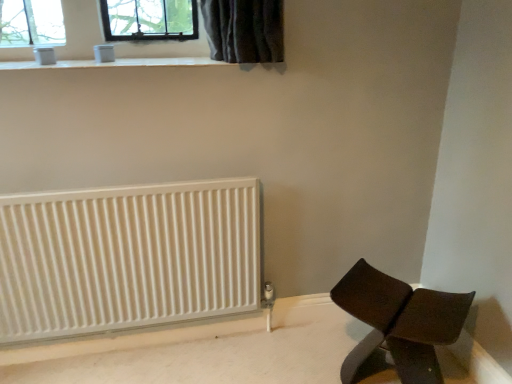
What is the approximate width of brown leather chair at lower right?

brown leather chair at lower right is 32.71 centimeters in width.

Describe the element at coordinates (114, 63) in the screenshot. This screenshot has height=384, width=512. I see `white smooth window sill at upper center` at that location.

Consider the image. In order to face white ribbed radiator at lower left, should I rotate leftwards or rightwards?

You should look left and rotate roughly 16.006 degrees.

Identify the location of brown leather chair at lower right. (400, 322).

Based on the photo, is brown leather chair at lower right smaller than white smooth window sill at upper center?

Actually, brown leather chair at lower right might be larger than white smooth window sill at upper center.

Does brown leather chair at lower right have a greater width compared to white smooth window sill at upper center?

No.

Does point (452, 293) come in front of point (201, 58)?

That is True.

Is white smooth window sill at upper center wider or thinner than white ribbed radiator at lower left?

Clearly, white smooth window sill at upper center has more width compared to white ribbed radiator at lower left.

Between white smooth window sill at upper center and white ribbed radiator at lower left, which one has less height?

white smooth window sill at upper center.

Is white smooth window sill at upper center facing towards white ribbed radiator at lower left?

No, white smooth window sill at upper center is not oriented towards white ribbed radiator at lower left.

From a real-world perspective, is white smooth window sill at upper center positioned above or below white ribbed radiator at lower left?

white smooth window sill at upper center is above white ribbed radiator at lower left.

From the picture: Is white ribbed radiator at lower left located within brown leather chair at lower right?

No, white ribbed radiator at lower left is located outside of brown leather chair at lower right.

Visually, is brown leather chair at lower right positioned to the left or to the right of white ribbed radiator at lower left?

From the image, it's evident that brown leather chair at lower right is to the right of white ribbed radiator at lower left.

Find the location of a particular element. This screenshot has width=512, height=384. radiator above the brown leather chair at lower right (from the image's perspective) is located at coordinates (128, 258).

Is brown leather chair at lower right further to the viewer compared to white ribbed radiator at lower left?

No.

From the image's perspective, would you say white ribbed radiator at lower left is shown under brown leather chair at lower right?

Actually, white ribbed radiator at lower left appears above brown leather chair at lower right in the image.

From a real-world perspective, is white ribbed radiator at lower left positioned over brown leather chair at lower right based on gravity?

Correct, in the physical world, white ribbed radiator at lower left is higher than brown leather chair at lower right.

I want to click on radiator above the brown leather chair at lower right (from a real-world perspective), so click(x=128, y=258).

Would you say white ribbed radiator at lower left is a long distance from brown leather chair at lower right?

Actually, white ribbed radiator at lower left and brown leather chair at lower right are a little close together.

The height and width of the screenshot is (384, 512). Find the location of `furniture in front of the white smooth window sill at upper center`. furniture in front of the white smooth window sill at upper center is located at coordinates [400, 322].

Is white smooth window sill at upper center facing towards brown leather chair at lower right?

No, white smooth window sill at upper center is not aimed at brown leather chair at lower right.

Is white smooth window sill at upper center touching brown leather chair at lower right?

No, white smooth window sill at upper center is not in contact with brown leather chair at lower right.

From the image's perspective, between white smooth window sill at upper center and brown leather chair at lower right, who is located below?

brown leather chair at lower right, from the image's perspective.

Is white ribbed radiator at lower left placed right next to white smooth window sill at upper center?

They are not placed beside each other.

From a real-world perspective, is white ribbed radiator at lower left physically located above or below white smooth window sill at upper center?

In terms of real-world spatial position, white ribbed radiator at lower left is below white smooth window sill at upper center.

Is white ribbed radiator at lower left facing towards white smooth window sill at upper center?

No, white ribbed radiator at lower left is not aimed at white smooth window sill at upper center.

Can you confirm if white ribbed radiator at lower left is wider than white smooth window sill at upper center?

No, white ribbed radiator at lower left is not wider than white smooth window sill at upper center.

The width and height of the screenshot is (512, 384). I want to click on window sill to the left of brown leather chair at lower right, so click(x=114, y=63).

Find the location of a particular element. The width and height of the screenshot is (512, 384). window sill in front of the white ribbed radiator at lower left is located at coordinates (114, 63).

Which object lies further to the anchor point brown leather chair at lower right, white smooth window sill at upper center or white ribbed radiator at lower left?

white smooth window sill at upper center lies further to brown leather chair at lower right than the other object.

Looking at the image, which one is located closer to white ribbed radiator at lower left, brown leather chair at lower right or white smooth window sill at upper center?

white smooth window sill at upper center is positioned closer to the anchor white ribbed radiator at lower left.

Looking at the image, which one is located closer to white smooth window sill at upper center, brown leather chair at lower right or white ribbed radiator at lower left?

white ribbed radiator at lower left lies closer to white smooth window sill at upper center than the other object.

Estimate the real-world distances between objects in this image. Which object is further from white smooth window sill at upper center, white ribbed radiator at lower left or brown leather chair at lower right?

The object further to white smooth window sill at upper center is brown leather chair at lower right.

Based on their spatial positions, is white ribbed radiator at lower left or white smooth window sill at upper center further from brown leather chair at lower right?

white smooth window sill at upper center.

From the image, which object appears to be nearer to white ribbed radiator at lower left, white smooth window sill at upper center or brown leather chair at lower right?

white smooth window sill at upper center is positioned closer to the anchor white ribbed radiator at lower left.

I want to click on window sill between white ribbed radiator at lower left and brown leather chair at lower right, so click(x=114, y=63).